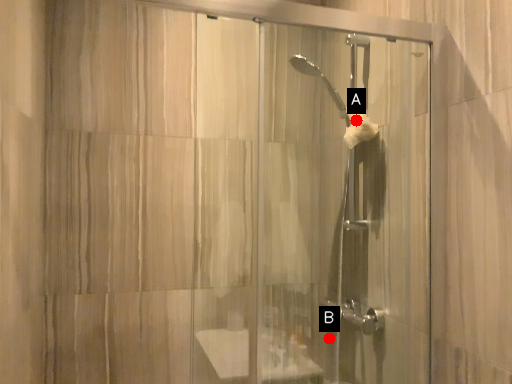
Question: Two points are circled on the image, labeled by A and B beside each circle. Which point is closer to the camera?

Choices:
 (A) A is closer
 (B) B is closer

Answer: (B)